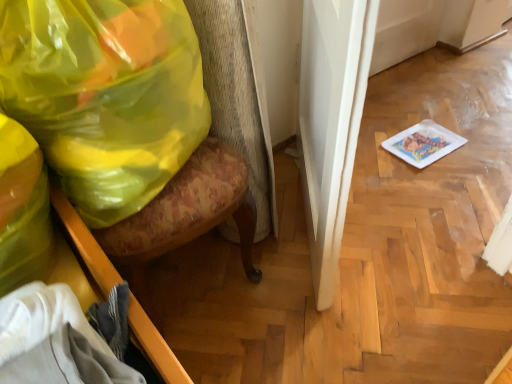
Image resolution: width=512 pixels, height=384 pixels. What do you see at coordinates (236, 99) in the screenshot? I see `floral fabric swivel chair at left` at bounding box center [236, 99].

What is the approximate width of wooden drawer at lower left?

11.76 inches.

What are the coordinates of `floral fabric swivel chair at left` in the screenshot? It's located at (236, 99).

Could you tell me if wooden drawer at lower left is facing floral fabric swivel chair at left?

No, wooden drawer at lower left is not oriented towards floral fabric swivel chair at left.

Is floral fabric swivel chair at left a part of wooden drawer at lower left?

No.

You are a GUI agent. You are given a task and a screenshot of the screen. Output one action in this format:
    pyautogui.click(x=<x>, y=<y>)
    Task: Click on the swivel chair on the left of the wooden drawer at lower left
    
    Given the screenshot: What is the action you would take?
    pyautogui.click(x=236, y=99)

Is wooden drawer at lower left positioned behind translucent yellow plastic bag at left?

No, the depth of wooden drawer at lower left is less than that of translucent yellow plastic bag at left.

Is wooden drawer at lower left wider or thinner than translucent yellow plastic bag at left?

wooden drawer at lower left is thinner than translucent yellow plastic bag at left.

Consider the image. Measure the distance between wooden drawer at lower left and translucent yellow plastic bag at left.

wooden drawer at lower left is 8.25 inches from translucent yellow plastic bag at left.

From a real-world perspective, which object rests below the other?

wooden drawer at lower left.

In the scene shown: Looking at their sizes, would you say translucent yellow plastic bag at left is wider or thinner than floral fabric swivel chair at left?

Clearly, translucent yellow plastic bag at left has less width compared to floral fabric swivel chair at left.

Is translucent yellow plastic bag at left bigger than floral fabric swivel chair at left?

No, translucent yellow plastic bag at left is not bigger than floral fabric swivel chair at left.

Is translucent yellow plastic bag at left positioned with its back to floral fabric swivel chair at left?

Absolutely, translucent yellow plastic bag at left is directed away from floral fabric swivel chair at left.

Who is more distant, translucent yellow plastic bag at left or floral fabric swivel chair at left?

translucent yellow plastic bag at left is behind.

In the scene shown: Are floral fabric swivel chair at left and wooden drawer at lower left far apart?

No, floral fabric swivel chair at left is not far away from wooden drawer at lower left.

Is floral fabric swivel chair at left positioned beyond the bounds of wooden drawer at lower left?

floral fabric swivel chair at left is positioned outside wooden drawer at lower left.

Locate an element on the screen. This screenshot has width=512, height=384. furniture lying on the right of floral fabric swivel chair at left is located at coordinates (84, 246).

From a real-world perspective, who is located lower, floral fabric swivel chair at left or wooden drawer at lower left?

In real-world perspective, floral fabric swivel chair at left is lower.

Considering the sizes of objects floral fabric swivel chair at left and translucent yellow plastic bag at left in the image provided, who is shorter, floral fabric swivel chair at left or translucent yellow plastic bag at left?

translucent yellow plastic bag at left is shorter.

In the image, is floral fabric swivel chair at left on the left side or the right side of translucent yellow plastic bag at left?

From the image, it's evident that floral fabric swivel chair at left is to the right of translucent yellow plastic bag at left.

Is floral fabric swivel chair at left wider or thinner than translucent yellow plastic bag at left?

floral fabric swivel chair at left is wider than translucent yellow plastic bag at left.

Considering the sizes of objects translucent yellow plastic bag at left and wooden drawer at lower left in the image provided, who is smaller, translucent yellow plastic bag at left or wooden drawer at lower left?

wooden drawer at lower left is smaller.

Considering the sizes of objects translucent yellow plastic bag at left and wooden drawer at lower left in the image provided, who is shorter, translucent yellow plastic bag at left or wooden drawer at lower left?

wooden drawer at lower left.

From the image's perspective, which one is positioned higher, translucent yellow plastic bag at left or wooden drawer at lower left?

translucent yellow plastic bag at left is shown above in the image.

What's the angular difference between translucent yellow plastic bag at left and wooden drawer at lower left's facing directions?

The angle between the facing direction of translucent yellow plastic bag at left and the facing direction of wooden drawer at lower left is 26.2 degrees.

Find the location of a particular element. The image size is (512, 384). swivel chair behind the wooden drawer at lower left is located at coordinates (236, 99).

I want to click on plastic bag to the left of wooden drawer at lower left, so click(x=105, y=95).

When comparing their distances from wooden drawer at lower left, does floral fabric swivel chair at left or translucent yellow plastic bag at left seem further?

floral fabric swivel chair at left is further to wooden drawer at lower left.

From the image, which object appears to be farther from wooden drawer at lower left, translucent yellow plastic bag at left or floral fabric swivel chair at left?

Based on the image, floral fabric swivel chair at left appears to be further to wooden drawer at lower left.

Which object lies further to the anchor point floral fabric swivel chair at left, translucent yellow plastic bag at left or wooden drawer at lower left?

wooden drawer at lower left is positioned further to the anchor floral fabric swivel chair at left.

Based on their spatial positions, is wooden drawer at lower left or translucent yellow plastic bag at left closer to floral fabric swivel chair at left?

translucent yellow plastic bag at left is positioned closer to the anchor floral fabric swivel chair at left.

Estimate the real-world distances between objects in this image. Which object is further from translucent yellow plastic bag at left, floral fabric swivel chair at left or wooden drawer at lower left?

Among the two, floral fabric swivel chair at left is located further to translucent yellow plastic bag at left.

Consider the image. Considering their positions, is wooden drawer at lower left positioned closer to translucent yellow plastic bag at left than floral fabric swivel chair at left?

wooden drawer at lower left.

Where is `swivel chair between translucent yellow plastic bag at left and wooden drawer at lower left from top to bottom`? The image size is (512, 384). swivel chair between translucent yellow plastic bag at left and wooden drawer at lower left from top to bottom is located at coordinates (236, 99).